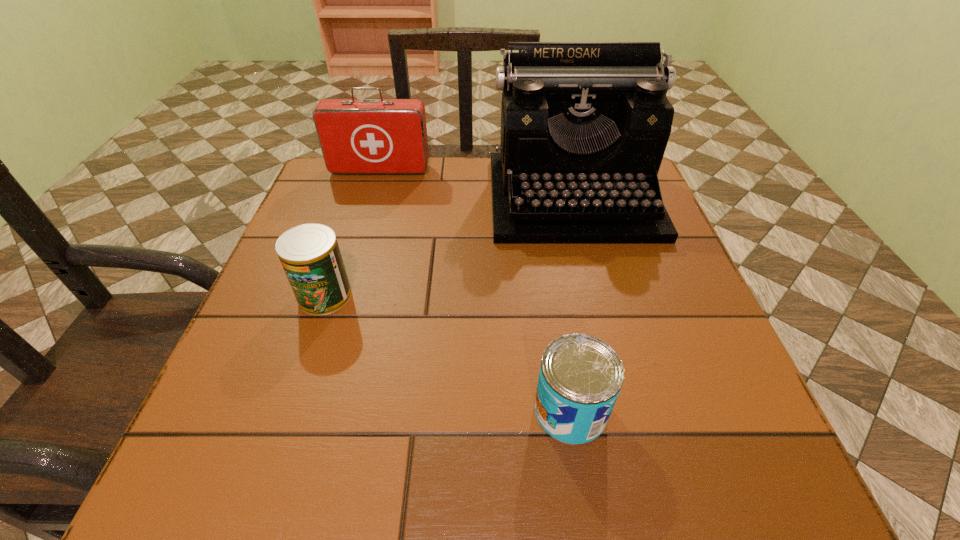
Where is `the tallest object`? Image resolution: width=960 pixels, height=540 pixels. the tallest object is located at coordinates (584, 125).

Find the location of a particular element. The image size is (960, 540). the first-aid kit is located at coordinates (357, 136).

The image size is (960, 540). I want to click on the farther can, so click(x=310, y=256).

Where is `the third farthest object`? the third farthest object is located at coordinates (310, 256).

The image size is (960, 540). In order to click on the nearest object in this screenshot , I will do `click(580, 377)`.

Identify the location of the right can. The height and width of the screenshot is (540, 960). (580, 377).

Where is `blank space located on the typing side of the tallest object`? The image size is (960, 540). blank space located on the typing side of the tallest object is located at coordinates (600, 306).

Locate an element on the screen. vacant area located 0.100m on the side of the first-aid kit with the first aid cross symbol is located at coordinates (372, 199).

At what (x,y) coordinates should I click in order to perform the action: click on free space located on the right of the farther can. Please return your answer as a coordinate pair (x, y). The image size is (960, 540). Looking at the image, I should click on (393, 296).

The height and width of the screenshot is (540, 960). I want to click on vacant space situated 0.070m on the left of the shortest object, so click(489, 410).